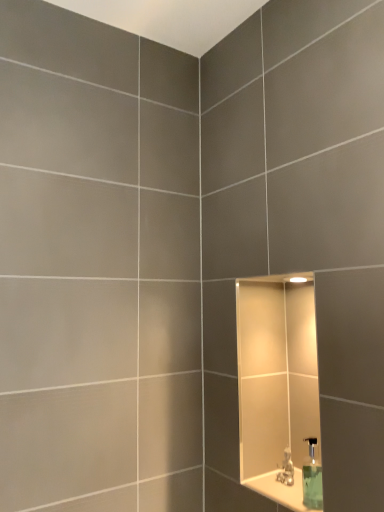
What is the approximate width of green translucent soap dispenser at lower right?

green translucent soap dispenser at lower right is 2.62 inches wide.

Find the location of a particular element. Image resolution: width=384 pixels, height=512 pixels. satin nickel faucet at lower right is located at coordinates (286, 469).

Is white glossy ledge at lower right beside green translucent soap dispenser at lower right?

Yes, white glossy ledge at lower right and green translucent soap dispenser at lower right clearly make contact.

From the image's perspective, is white glossy ledge at lower right located beneath green translucent soap dispenser at lower right?

Yes, from the image's perspective, white glossy ledge at lower right is beneath green translucent soap dispenser at lower right.

Is point (301, 483) farther from viewer compared to point (316, 499)?

Yes.

From the image's perspective, would you say green translucent soap dispenser at lower right is positioned over satin nickel faucet at lower right?

Yes, from the image's perspective, green translucent soap dispenser at lower right is above satin nickel faucet at lower right.

Is satin nickel faucet at lower right located within green translucent soap dispenser at lower right?

No, satin nickel faucet at lower right is not surrounded by green translucent soap dispenser at lower right.

Consider the image. Which is behind, green translucent soap dispenser at lower right or satin nickel faucet at lower right?

Positioned behind is satin nickel faucet at lower right.

Is green translucent soap dispenser at lower right positioned with its back to satin nickel faucet at lower right?

That's not correct — green translucent soap dispenser at lower right is not looking away from satin nickel faucet at lower right.

Is satin nickel faucet at lower right directly adjacent to white glossy ledge at lower right?

Yes, the surface of satin nickel faucet at lower right is in contact with white glossy ledge at lower right.

From the image's perspective, is satin nickel faucet at lower right above or below white glossy ledge at lower right?

Clearly, from the image's perspective, satin nickel faucet at lower right is above white glossy ledge at lower right.

Does point (286, 478) appear closer or farther from the camera than point (263, 484)?

Point (286, 478) appears to be farther away from the viewer than point (263, 484).

At what (x,y) coordinates should I click in order to perform the action: click on tap on the left of white glossy ledge at lower right. Please return your answer as a coordinate pair (x, y). This screenshot has width=384, height=512. Looking at the image, I should click on (286, 469).

From the image's perspective, which object appears higher, white glossy ledge at lower right or satin nickel faucet at lower right?

satin nickel faucet at lower right.

Is point (301, 499) positioned behind point (280, 480)?

No, it is in front of (280, 480).

Which is more to the left, white glossy ledge at lower right or satin nickel faucet at lower right?

Positioned to the left is satin nickel faucet at lower right.

How much distance is there between white glossy ledge at lower right and satin nickel faucet at lower right?

The distance of white glossy ledge at lower right from satin nickel faucet at lower right is 1.93 inches.

Is green translucent soap dispenser at lower right far away from white glossy ledge at lower right?

No, green translucent soap dispenser at lower right is not far from white glossy ledge at lower right.

Is green translucent soap dispenser at lower right looking in the opposite direction of white glossy ledge at lower right?

That's not correct — green translucent soap dispenser at lower right is not looking away from white glossy ledge at lower right.

Do you think green translucent soap dispenser at lower right is within white glossy ledge at lower right, or outside of it?

green translucent soap dispenser at lower right is located beyond the bounds of white glossy ledge at lower right.

From the image's perspective, is satin nickel faucet at lower right located above or below green translucent soap dispenser at lower right?

satin nickel faucet at lower right is below green translucent soap dispenser at lower right.

Considering the positions of objects satin nickel faucet at lower right and green translucent soap dispenser at lower right in the image provided, who is more to the right, satin nickel faucet at lower right or green translucent soap dispenser at lower right?

From the viewer's perspective, green translucent soap dispenser at lower right appears more on the right side.

Is satin nickel faucet at lower right wider than green translucent soap dispenser at lower right?

No.

Identify the location of soap dispenser behind the white glossy ledge at lower right. (312, 478).

In the image, there is a green translucent soap dispenser at lower right. Where is `tap below it (from the image's perspective)`? tap below it (from the image's perspective) is located at coordinates (286, 469).

Based on their spatial positions, is white glossy ledge at lower right or satin nickel faucet at lower right further from green translucent soap dispenser at lower right?

The object further to green translucent soap dispenser at lower right is satin nickel faucet at lower right.

Based on their spatial positions, is green translucent soap dispenser at lower right or satin nickel faucet at lower right closer to white glossy ledge at lower right?

satin nickel faucet at lower right is closer to white glossy ledge at lower right.

Looking at the image, which one is located closer to green translucent soap dispenser at lower right, satin nickel faucet at lower right or white glossy ledge at lower right?

white glossy ledge at lower right.

Considering their positions, is satin nickel faucet at lower right positioned closer to white glossy ledge at lower right than green translucent soap dispenser at lower right?

Based on the image, satin nickel faucet at lower right appears to be nearer to white glossy ledge at lower right.

From the image, which object appears to be nearer to satin nickel faucet at lower right, green translucent soap dispenser at lower right or white glossy ledge at lower right?

white glossy ledge at lower right.

Based on their spatial positions, is white glossy ledge at lower right or green translucent soap dispenser at lower right further from satin nickel faucet at lower right?

Based on the image, green translucent soap dispenser at lower right appears to be further to satin nickel faucet at lower right.

The image size is (384, 512). What are the coordinates of `soap dispenser located between white glossy ledge at lower right and satin nickel faucet at lower right in the depth direction` in the screenshot? It's located at (312, 478).